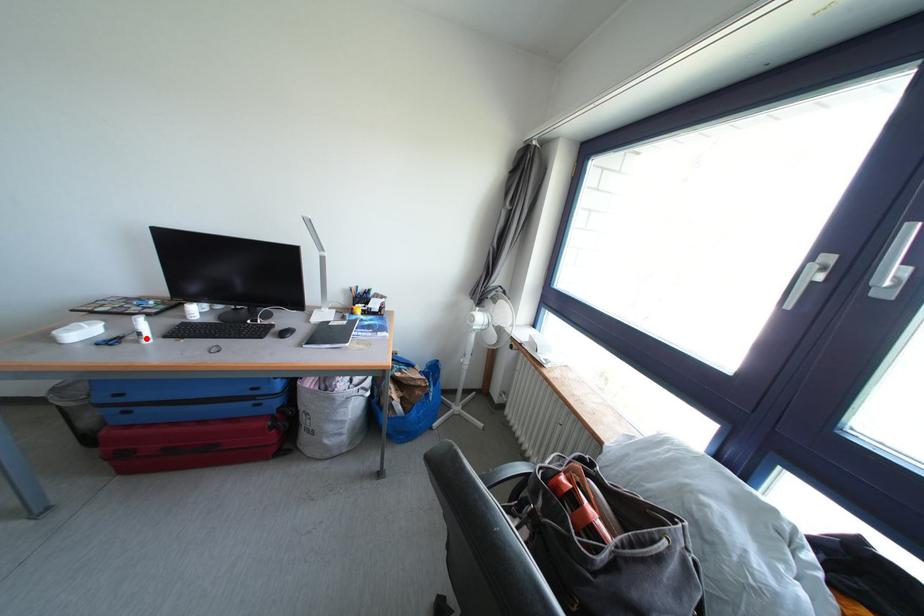
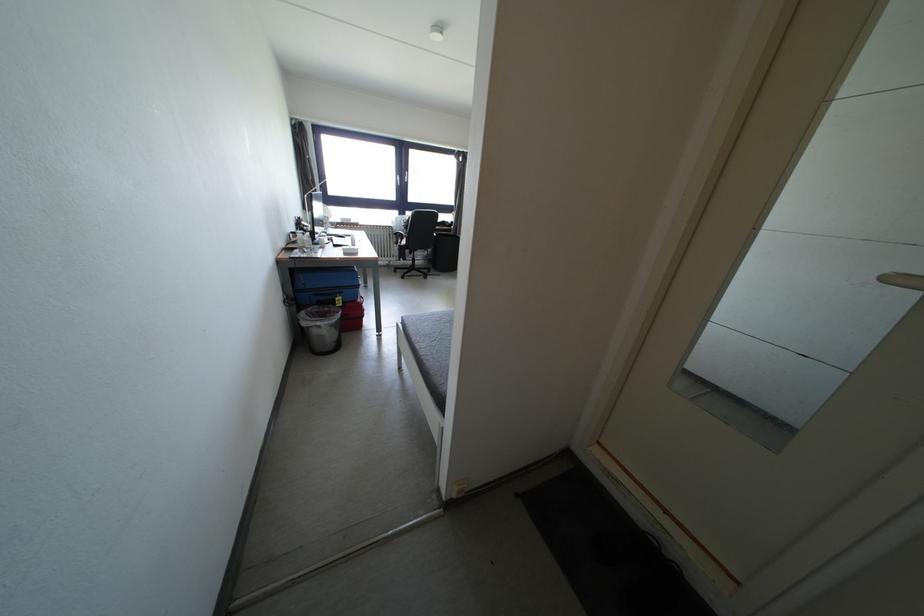
Question: I am providing you with two images of the same scene from different viewpoints. A red point is marked on the first image. Can you still see the location of the red point in image 2?

Choices:
 (A) Yes
 (B) No

Answer: (B)